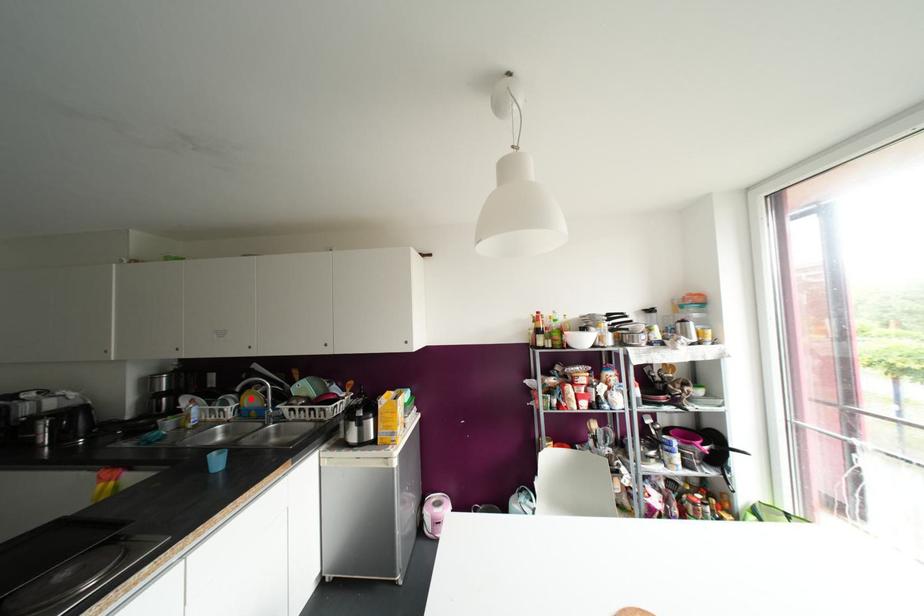
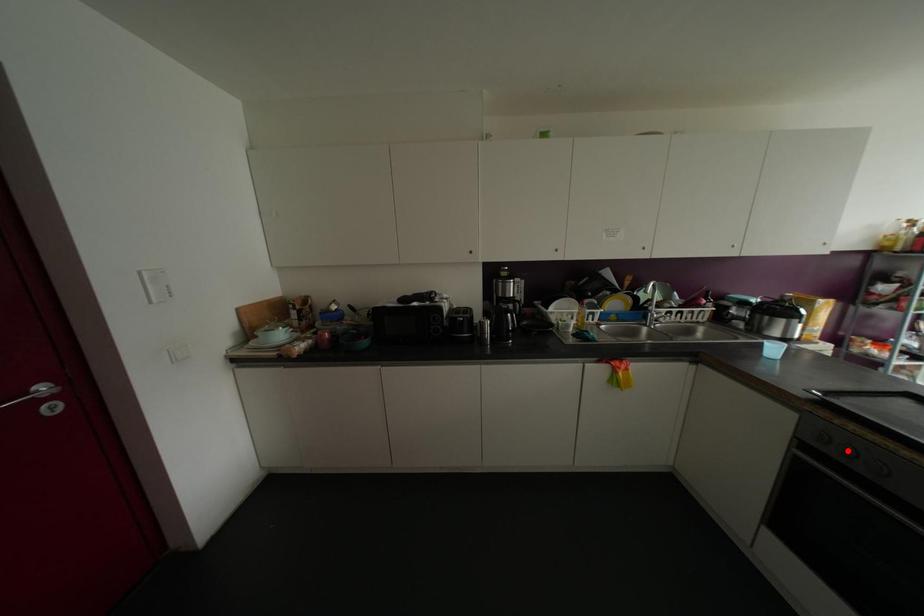
I am providing you with two images of the same scene from different viewpoints. A red point is marked on the first image and another point is marked on the second image. Are the points marked in image1 and image2 representing the same 3D position?

No